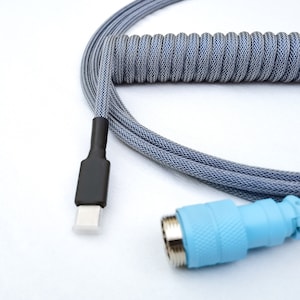
Find the location of `white surface`. white surface is located at coordinates (130, 252).